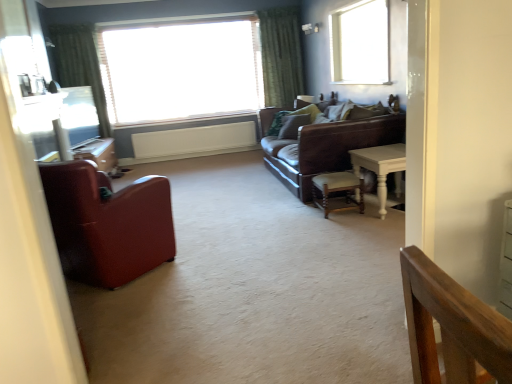
You are a GUI agent. You are given a task and a screenshot of the screen. Output one action in this format:
    pyautogui.click(x=<x>, y=<y>)
    Task: Click on the vacant area that lies in front of wooden chair at center, which is the second chair from left to right
    
    Given the screenshot: What is the action you would take?
    pyautogui.click(x=349, y=228)